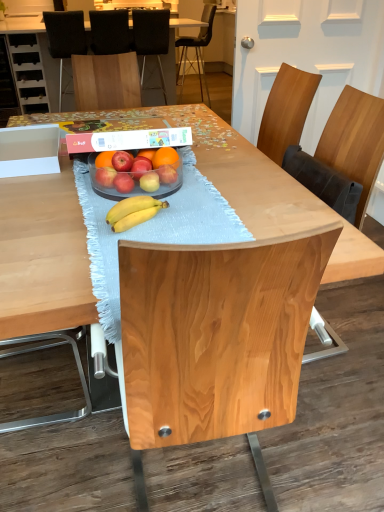
Question: Is black fabric chair at upper left, positioned as the 2th chair in front-to-back order, to the left or to the right of black fabric chair at upper center, which appears as the 3th chair when viewed from the back, in the image?

Choices:
 (A) left
 (B) right

Answer: (A)

Question: Is black fabric chair at upper left, positioned as the 2th chair in front-to-back order, situated inside black fabric chair at upper center, which appears as the 3th chair when viewed from the front, or outside?

Choices:
 (A) outside
 (B) inside

Answer: (A)

Question: Which of these objects is positioned closest to the matte red apple at center, which appears as the first apple when viewed from the right?

Choices:
 (A) light blue textured tablecloth at center
 (B) black fabric chair at upper center, which appears as the 3th chair when viewed from the back
 (C) natural wood chair at center, marked as the 5th chair in a back-to-front arrangement
 (D) wooden table at center
 (E) orangesmoothfruit at center

Answer: (E)

Question: Which of these objects is positioned closest to the matte red apple at center, which appears as the first apple when viewed from the right?

Choices:
 (A) wooden table at center
 (B) black leather chair at upper center, acting as the first chair starting from the back
 (C) natural wood chair at center, the 1th chair from the front
 (D) matte red apple at center, the 5th apple viewed from the left
 (E) black fabric chair at center, which ranks as the 2th chair in back-to-front order

Answer: (D)